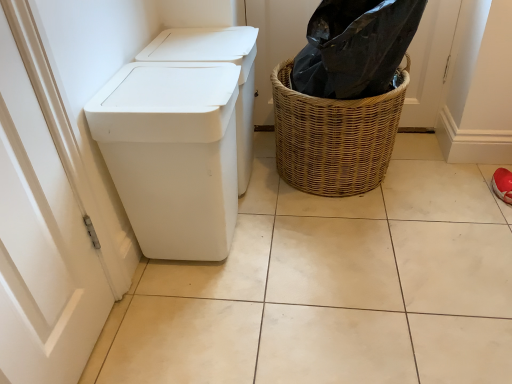
Identify the location of free point above white plastic waste container at left (from a real-world perspective). This screenshot has width=512, height=384. coord(159,89).